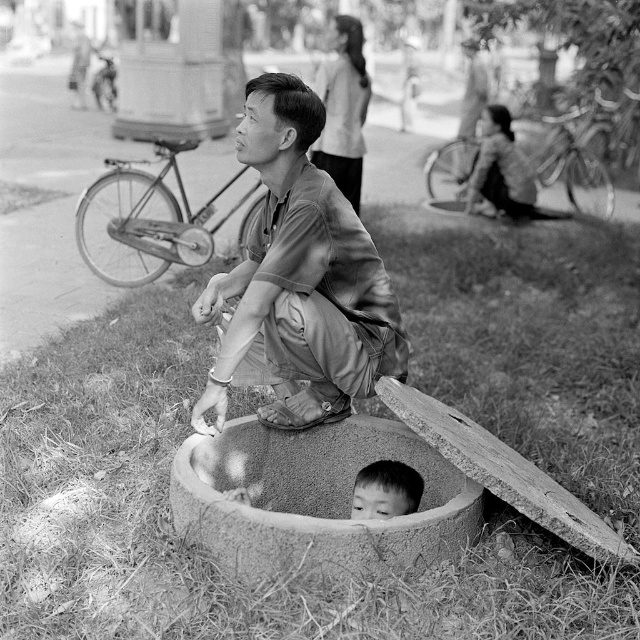
Between smooth concrete basin at lower center and smooth skin child at center, which one is positioned lower?

smooth concrete basin at lower center is below.

How distant is smooth concrete basin at lower center from smooth skin child at center?

smooth concrete basin at lower center and smooth skin child at center are 15.16 inches apart.

Between point (260, 531) and point (381, 513), which one is positioned behind?

Point (381, 513)

Locate an element on the screen. smooth concrete basin at lower center is located at coordinates coord(316,500).

Does point (396, 314) lie behind point (356, 515)?

Yes, point (396, 314) is farther from viewer.

In order to click on matte brown shirt at center in this screenshot , I will do `click(300, 275)`.

Is point (305, 179) positioned in front of point (440, 454)?

Yes, point (305, 179) is in front of point (440, 454).

Does matte brown shirt at center have a lesser height compared to smooth concrete basin at lower center?

Incorrect, matte brown shirt at center's height does not fall short of smooth concrete basin at lower center's.

Image resolution: width=640 pixels, height=640 pixels. I want to click on matte brown shirt at center, so [x=300, y=275].